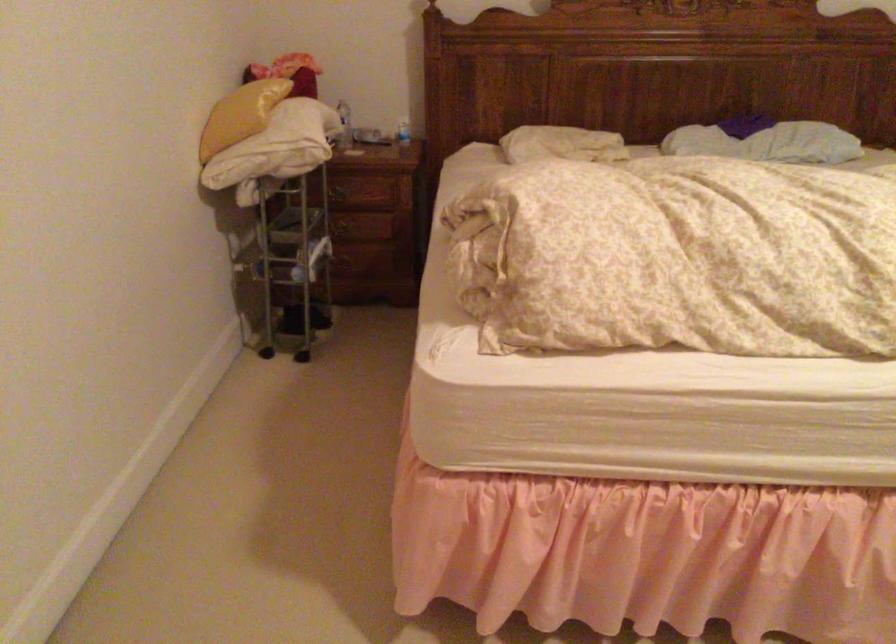
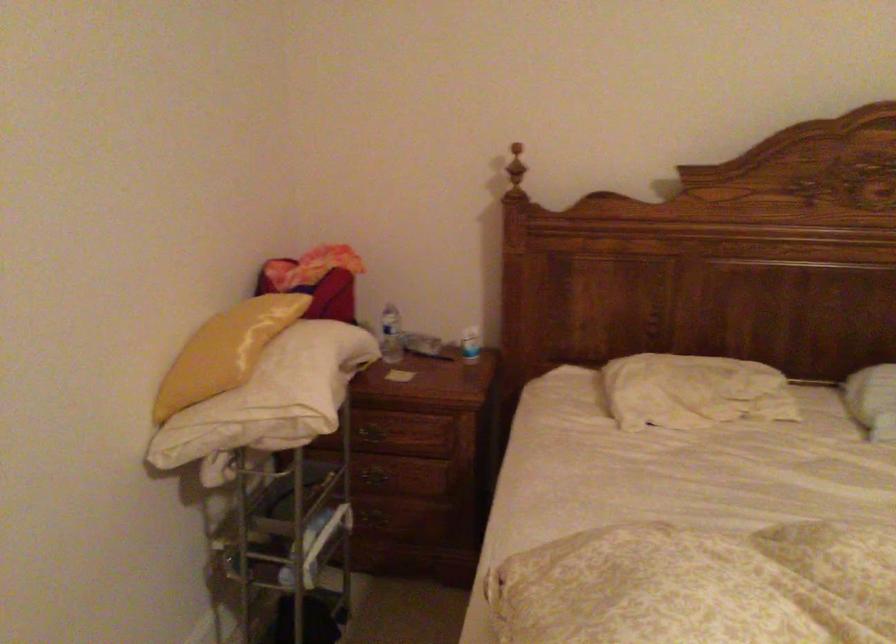
Question: In a continuous first-person perspective shot, in which direction is the camera moving?

Choices:
 (A) Left
 (B) Right
 (C) Forward
 (D) Backward

Answer: (C)